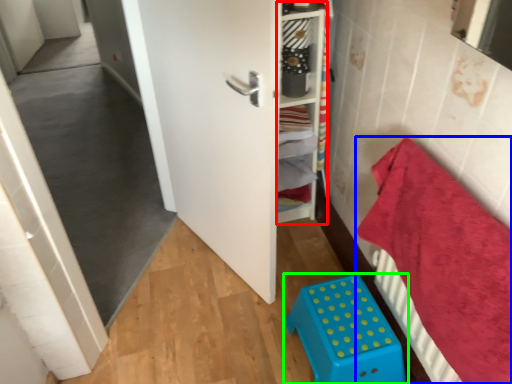
Question: Based on their relative distances, which object is farther from shelf (highlighted by a red box)? Choose from bedding (highlighted by a blue box) and furniture (highlighted by a green box).

Choices:
 (A) bedding
 (B) furniture

Answer: (B)